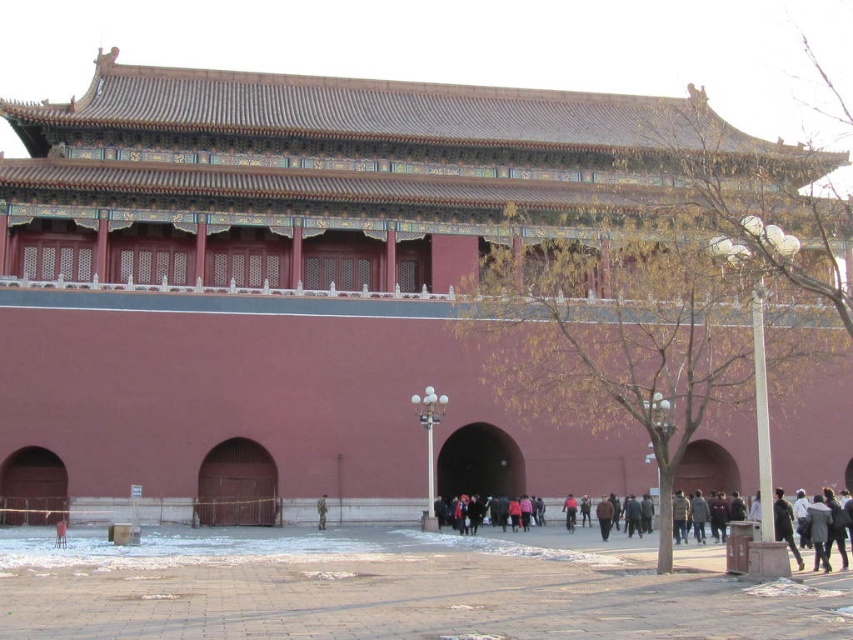
Question: Which of the following is the farthest from the observer?

Choices:
 (A) dark gray sweater at center
 (B) camouflage uniform at center

Answer: (B)

Question: Which object is farther from the camera taking this photo?

Choices:
 (A) camouflage uniform at center
 (B) dark gray sweater at center
 (C) brick pavement at center

Answer: (A)

Question: Is the position of brick pavement at center less distant than that of camouflage uniform at center?

Choices:
 (A) yes
 (B) no

Answer: (A)

Question: Where is dark gray sweater at center located in relation to camouflage uniform at center in the image?

Choices:
 (A) left
 (B) right

Answer: (B)

Question: Can you confirm if brick pavement at center is positioned to the left of dark gray sweater at center?

Choices:
 (A) yes
 (B) no

Answer: (A)

Question: Among these objects, which one is farthest from the camera?

Choices:
 (A) camouflage uniform at center
 (B) dark gray sweater at center
 (C) brick pavement at center

Answer: (A)